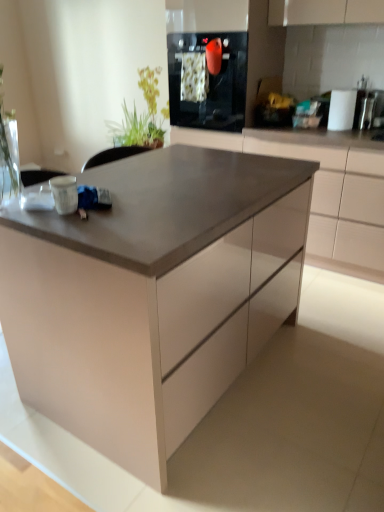
Describe the element at coordinates (152, 295) in the screenshot. I see `matte gray table at center` at that location.

The width and height of the screenshot is (384, 512). What do you see at coordinates (207, 81) in the screenshot?
I see `black glass oven at upper center` at bounding box center [207, 81].

Identify the location of green leafy plant at upper left. (152, 104).

Measure the distance between point (337,139) and camera.

The distance of point (337,139) from camera is 8.23 feet.

Identify the location of matte gray table at center. Image resolution: width=384 pixels, height=512 pixels. (152, 295).

Is green leafy plant at upper left not inside black glass oven at upper center?

Yes.

Considering the positions of point (154, 72) and point (176, 42), is point (154, 72) closer or farther from the camera than point (176, 42)?

Point (154, 72) is positioned farther from the camera compared to point (176, 42).

From a real-world perspective, relative to black glass oven at upper center, is green leafy plant at upper left vertically above or below?

Clearly, from a real-world perspective, green leafy plant at upper left is below black glass oven at upper center.

Find the location of a particular element. The image size is (384, 512). plant beneath the black glass oven at upper center (from a real-world perspective) is located at coordinates (152, 104).

Does matte white cabinet at center appear on the right side of matte gray table at center?

Indeed, matte white cabinet at center is positioned on the right side of matte gray table at center.

Locate an element on the screen. table on the left of the matte white cabinet at center is located at coordinates (152, 295).

From the image's perspective, is matte white cabinet at center under matte gray table at center?

Incorrect, from the image's perspective, matte white cabinet at center is higher than matte gray table at center.

Can you tell me how much green leafy plant at upper left and matte white cabinet at center differ in facing direction?

The angular difference between green leafy plant at upper left and matte white cabinet at center is 0.476 degrees.

Is green leafy plant at upper left thinner than matte white cabinet at center?

Correct, the width of green leafy plant at upper left is less than that of matte white cabinet at center.

Does green leafy plant at upper left come in front of matte white cabinet at center?

No, green leafy plant at upper left is further to the viewer.

From the image's perspective, is black glass oven at upper center located beneath matte white cabinet at center?

Incorrect, from the image's perspective, black glass oven at upper center is higher than matte white cabinet at center.

Does point (236, 127) come closer to viewer compared to point (348, 168)?

No, (236, 127) is behind (348, 168).

Is black glass oven at upper center placed right next to matte white cabinet at center?

There is a gap between black glass oven at upper center and matte white cabinet at center.

From a real-world perspective, which object stands above the other?

black glass oven at upper center.

Considering the positions of objects matte gray table at center and matte white cabinet at center in the image provided, who is behind, matte gray table at center or matte white cabinet at center?

Positioned behind is matte white cabinet at center.

Which point is more forward, (227, 316) or (377, 238)?

The point (227, 316) is closer to the camera.

Could matte white cabinet at center be considered to be inside matte gray table at center?

No, matte gray table at center does not contain matte white cabinet at center.

Based on the photo, how different are the orientations of matte gray table at center and matte white cabinet at center in degrees?

matte gray table at center and matte white cabinet at center are facing 90.7 degrees away from each other.

Between matte white cabinet at center and green leafy plant at upper left, which one has larger width?

With larger width is matte white cabinet at center.

Measure the distance between matte white cabinet at center and green leafy plant at upper left.

5.26 feet.

Is matte white cabinet at center oriented away from green leafy plant at upper left?

No, matte white cabinet at center's orientation is not away from green leafy plant at upper left.

You are a GUI agent. You are given a task and a screenshot of the screen. Output one action in this format:
    pyautogui.click(x=<x>, y=<y>)
    Task: Click on the cabinetry below the green leafy plant at upper left (from a real-world perspective)
    The image size is (384, 512).
    Given the screenshot: What is the action you would take?
    pyautogui.click(x=325, y=191)

What's the angular difference between black glass oven at upper center and green leafy plant at upper left's facing directions?

There is a 0.476-degree angle between the facing directions of black glass oven at upper center and green leafy plant at upper left.

Is black glass oven at upper center located outside green leafy plant at upper left?

black glass oven at upper center is positioned outside green leafy plant at upper left.

Is point (206, 61) positioned in front of point (154, 110)?

That is True.

From a real-world perspective, between black glass oven at upper center and green leafy plant at upper left, who is vertically higher?

In real-world perspective, black glass oven at upper center is above.

Locate an element on the screen. plant behind the black glass oven at upper center is located at coordinates (152, 104).

I want to click on table in front of the matte white cabinet at center, so click(152, 295).

Looking at this image, looking at the image, which one is located further to black glass oven at upper center, matte white cabinet at center or matte gray table at center?

The object further to black glass oven at upper center is matte gray table at center.

Which object lies further to the anchor point black glass oven at upper center, matte white cabinet at center or green leafy plant at upper left?

Among the two, green leafy plant at upper left is located further to black glass oven at upper center.

From the image, which object appears to be farther from matte white cabinet at center, green leafy plant at upper left or black glass oven at upper center?

green leafy plant at upper left is further to matte white cabinet at center.

Based on their spatial positions, is green leafy plant at upper left or matte gray table at center closer to black glass oven at upper center?

green leafy plant at upper left is positioned closer to the anchor black glass oven at upper center.

Looking at this image, considering their positions, is green leafy plant at upper left positioned further to black glass oven at upper center than matte white cabinet at center?

green leafy plant at upper left is further to black glass oven at upper center.

In the scene shown: Based on their spatial positions, is black glass oven at upper center or matte gray table at center closer to matte white cabinet at center?

black glass oven at upper center.

When comparing their distances from matte white cabinet at center, does matte gray table at center or green leafy plant at upper left seem further?

green leafy plant at upper left.

From the image, which object appears to be farther from matte gray table at center, green leafy plant at upper left or matte white cabinet at center?

green leafy plant at upper left lies further to matte gray table at center than the other object.

This screenshot has width=384, height=512. Find the location of `cabinetry between matte gray table at center and black glass oven at upper center along the z-axis`. cabinetry between matte gray table at center and black glass oven at upper center along the z-axis is located at coordinates (325, 191).

Where is `cabinetry positioned between matte gray table at center and green leafy plant at upper left from near to far`? Image resolution: width=384 pixels, height=512 pixels. cabinetry positioned between matte gray table at center and green leafy plant at upper left from near to far is located at coordinates (325, 191).

You are a GUI agent. You are given a task and a screenshot of the screen. Output one action in this format:
    pyautogui.click(x=<x>, y=<y>)
    Task: Click on the kitchen appliance located between green leafy plant at upper left and matte white cabinet at center in the left-right direction
    
    Given the screenshot: What is the action you would take?
    pyautogui.click(x=207, y=81)

This screenshot has height=512, width=384. What are the coordinates of `kitchen appliance positioned between matte gray table at center and green leafy plant at upper left from near to far` in the screenshot? It's located at (207, 81).